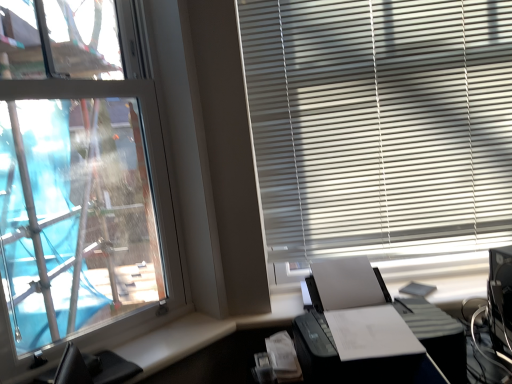
What do you see at coordinates (82, 176) in the screenshot? I see `transparent glass window at left` at bounding box center [82, 176].

Where is `white matte blinds at upper right`? white matte blinds at upper right is located at coordinates (380, 124).

At what (x,y) coordinates should I click in order to perform the action: click on window blind above the transparent glass window at left (from the image's perspective). Please return your answer as a coordinate pair (x, y). The height and width of the screenshot is (384, 512). Looking at the image, I should click on (380, 124).

Would you say white matte blinds at upper right contains transparent glass window at left?

Actually, transparent glass window at left is outside white matte blinds at upper right.

Is white matte blinds at upper right smaller than transparent glass window at left?

Correct, white matte blinds at upper right occupies less space than transparent glass window at left.

Is black plastic printer at lower right smaller than white matte blinds at upper right?

No.

I want to click on printer below the white matte blinds at upper right (from the image's perspective), so coord(359,330).

What's the angular difference between black plastic printer at lower right and white matte blinds at upper right's facing directions?

The angle between the facing direction of black plastic printer at lower right and the facing direction of white matte blinds at upper right is 2.62 degrees.

Does black plastic printer at lower right appear on the left side of white matte blinds at upper right?

Indeed, black plastic printer at lower right is positioned on the left side of white matte blinds at upper right.

Is black leather computer chair at lower left positioned with its back to black plastic printer at lower right?

No, black plastic printer at lower right is not at the back of black leather computer chair at lower left.

Is black leather computer chair at lower left positioned behind black plastic printer at lower right?

Yes, black leather computer chair at lower left is further from the viewer.

Is black leather computer chair at lower left not within black plastic printer at lower right?

Indeed, black leather computer chair at lower left is completely outside black plastic printer at lower right.

Considering the relative sizes of black leather computer chair at lower left and black plastic printer at lower right in the image provided, is black leather computer chair at lower left bigger than black plastic printer at lower right?

Actually, black leather computer chair at lower left might be smaller than black plastic printer at lower right.

Considering the positions of points (375, 277) and (55, 376), is point (375, 277) closer to camera compared to point (55, 376)?

No.

Is black leather computer chair at lower left a part of black plastic printer at lower right?

That's incorrect, black leather computer chair at lower left is not inside black plastic printer at lower right.

From the image's perspective, is black plastic printer at lower right above or below black leather computer chair at lower left?

black plastic printer at lower right is above black leather computer chair at lower left.

What are the coordinates of `computer chair that appears below the transparent glass window at left (from a real-world perspective)` in the screenshot? It's located at (100, 368).

How much distance is there between black leather computer chair at lower left and transparent glass window at left?

They are 3.83 feet apart.

In terms of width, does black leather computer chair at lower left look wider or thinner when compared to transparent glass window at left?

In the image, black leather computer chair at lower left appears to be wider than transparent glass window at left.

From the image's perspective, who appears lower, black leather computer chair at lower left or transparent glass window at left?

black leather computer chair at lower left, from the image's perspective.

Is point (377, 304) more distant than point (28, 332)?

No, it is not.

From the image's perspective, which one is positioned higher, black plastic printer at lower right or transparent glass window at left?

transparent glass window at left.

Between black plastic printer at lower right and transparent glass window at left, which one is positioned behind?

black plastic printer at lower right is further away from the camera.

Who is bigger, black plastic printer at lower right or transparent glass window at left?

With larger size is black plastic printer at lower right.

From the image's perspective, relative to black plastic printer at lower right, is white matte blinds at upper right above or below?

Clearly, from the image's perspective, white matte blinds at upper right is above black plastic printer at lower right.

The height and width of the screenshot is (384, 512). Find the location of `printer below the white matte blinds at upper right (from the image's perspective)`. printer below the white matte blinds at upper right (from the image's perspective) is located at coordinates (359, 330).

Based on their positions, is white matte blinds at upper right located to the left or right of black plastic printer at lower right?

Based on their positions, white matte blinds at upper right is located to the right of black plastic printer at lower right.

Looking at this image, how different are the orientations of white matte blinds at upper right and black plastic printer at lower right in degrees?

2.62 degrees separate the facing orientations of white matte blinds at upper right and black plastic printer at lower right.

Identify the location of window blind behind the transparent glass window at left. The width and height of the screenshot is (512, 384). (380, 124).

At what (x,y) coordinates should I click in order to perform the action: click on printer below the white matte blinds at upper right (from the image's perspective). Please return your answer as a coordinate pair (x, y). Looking at the image, I should click on (359, 330).

Looking at this image, looking at the image, which one is located further to black leather computer chair at lower left, black plastic printer at lower right or transparent glass window at left?

Among the two, transparent glass window at left is located further to black leather computer chair at lower left.

Which object lies nearer to the anchor point transparent glass window at left, black plastic printer at lower right or white matte blinds at upper right?

white matte blinds at upper right is positioned closer to the anchor transparent glass window at left.

Looking at the image, which one is located closer to transparent glass window at left, black leather computer chair at lower left or white matte blinds at upper right?

Among the two, white matte blinds at upper right is located nearer to transparent glass window at left.

Consider the image. When comparing their distances from white matte blinds at upper right, does black plastic printer at lower right or transparent glass window at left seem closer?

black plastic printer at lower right.

From the image, which object appears to be nearer to black plastic printer at lower right, white matte blinds at upper right or transparent glass window at left?

white matte blinds at upper right is closer to black plastic printer at lower right.

From the image, which object appears to be farther from white matte blinds at upper right, black leather computer chair at lower left or transparent glass window at left?

Among the two, black leather computer chair at lower left is located further to white matte blinds at upper right.

Looking at the image, which one is located further to black leather computer chair at lower left, black plastic printer at lower right or white matte blinds at upper right?

white matte blinds at upper right is positioned further to the anchor black leather computer chair at lower left.

When comparing their distances from transparent glass window at left, does black plastic printer at lower right or black leather computer chair at lower left seem further?

Among the two, black plastic printer at lower right is located further to transparent glass window at left.

At what (x,y) coordinates should I click in order to perform the action: click on computer chair situated between transparent glass window at left and black plastic printer at lower right from left to right. Please return your answer as a coordinate pair (x, y). This screenshot has height=384, width=512. Looking at the image, I should click on (100, 368).

Identify the location of printer between black leather computer chair at lower left and white matte blinds at upper right from left to right. This screenshot has height=384, width=512. coord(359,330).

Locate an element on the screen. Image resolution: width=512 pixels, height=384 pixels. printer between transparent glass window at left and white matte blinds at upper right is located at coordinates (359, 330).

The width and height of the screenshot is (512, 384). Identify the location of computer chair between transparent glass window at left and white matte blinds at upper right from left to right. (100, 368).